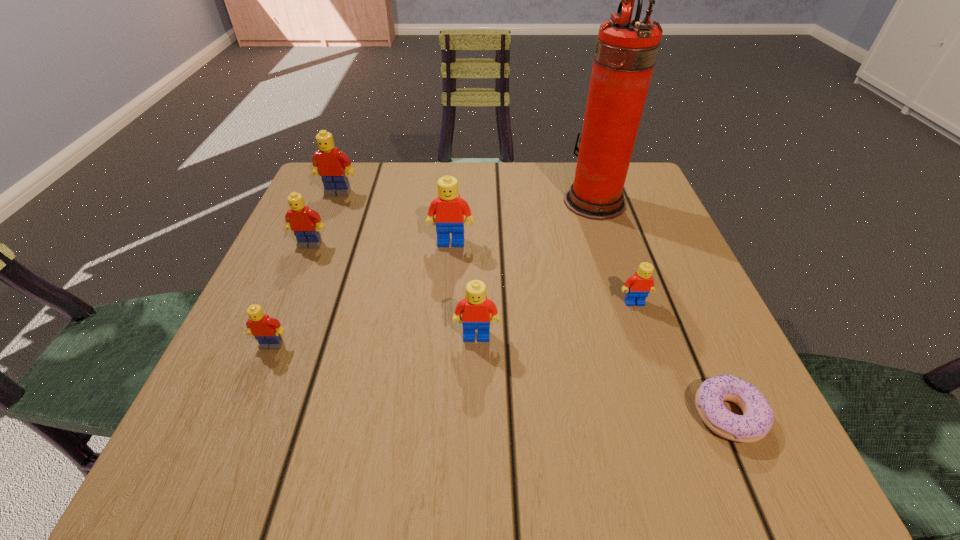
Locate an element on the screen. Image resolution: width=960 pixels, height=540 pixels. the second closest yellow Lego to the second biggest red Lego is located at coordinates (301, 219).

Identify the location of red Lego object that ranks as the third closest to the nearest object. (449, 208).

Identify which red Lego is the nearest to the second nearest yellow Lego. Please provide its 2D coordinates. Your answer should be formatted as a tuple, i.e. [(x, y)], where the tuple contains the x and y coordinates of a point satisfying the conditions above.

[(449, 208)]

The height and width of the screenshot is (540, 960). I want to click on free space that satisfies the following two spatial constraints: 1. at the discharge end of the fire extinguisher; 2. on the front-facing side of the nearest yellow Lego, so click(641, 345).

The image size is (960, 540). I want to click on free space that satisfies the following two spatial constraints: 1. at the discharge end of the fire extinguisher; 2. on the front-facing side of the nearest yellow Lego, so click(641, 345).

Find the location of `vacant space that satisfies the following two spatial constraints: 1. at the discharge end of the fire extinguisher; 2. on the face of the second smallest red Lego`. vacant space that satisfies the following two spatial constraints: 1. at the discharge end of the fire extinguisher; 2. on the face of the second smallest red Lego is located at coordinates (638, 336).